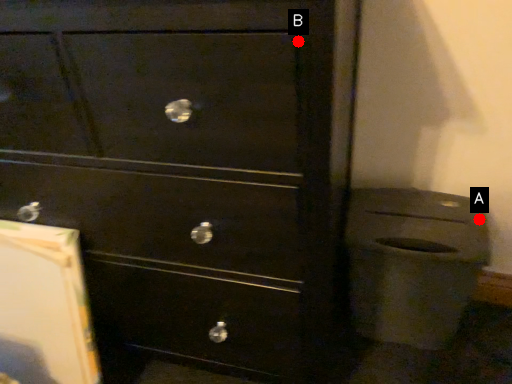
Question: Two points are circled on the image, labeled by A and B beside each circle. Among these points, which one is nearest to the camera?

Choices:
 (A) A is closer
 (B) B is closer

Answer: (B)